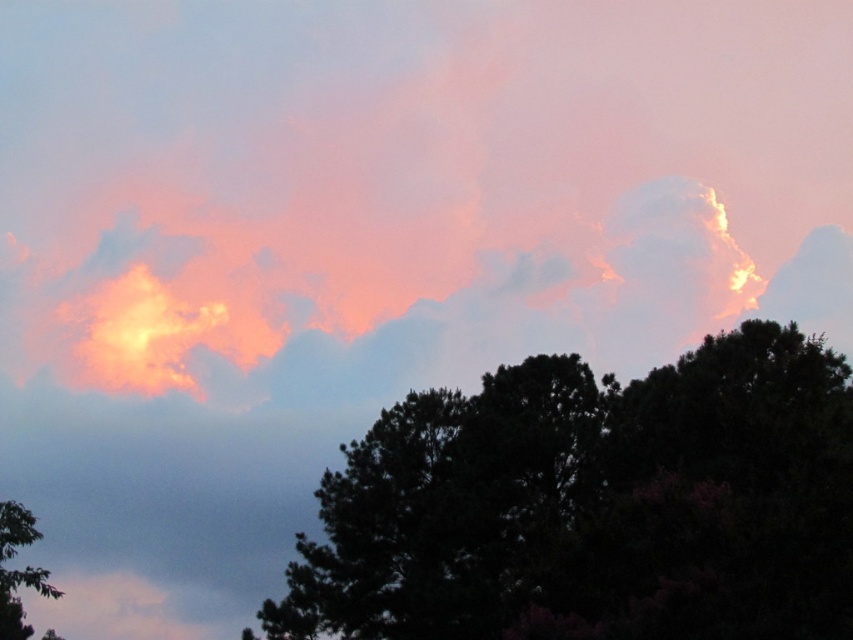
You are standing in a field and see the dark green leafy tree at center and the green leafy tree at lower left. Which tree would you need to look up to more to see the top?

The green leafy tree at lower left is taller than the dark green leafy tree at center, so you would need to look up more to see its top.